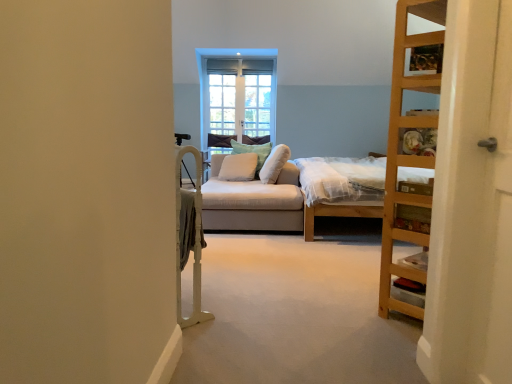
Question: In terms of width, does white soft cushion at center, arranged as the third pillow when viewed from the right, look wider or thinner when compared to clear glass window at center?

Choices:
 (A) thin
 (B) wide

Answer: (B)

Question: In the image, is white soft cushion at center, marked as the 1th pillow in a left-to-right arrangement, positioned in front of or behind clear glass window at center?

Choices:
 (A) behind
 (B) front

Answer: (B)

Question: Considering the real-world distances, which object is closest to the white soft cushion at center, arranged as the third pillow when viewed from the right?

Choices:
 (A) white wood screen door at right
 (B) light brown wooden bed at right
 (C) wooden ladder at right
 (D) clear glass window at center
 (E) white soft pillow at center, which is the first pillow from right to left

Answer: (E)

Question: Based on their relative distances, which object is farther from the white soft pillow at center, which is the first pillow from right to left?

Choices:
 (A) white wood screen door at right
 (B) light brown wooden bed at right
 (C) light beige fabric couch at center
 (D) white soft pillow at center, placed as the 2th pillow when sorted from left to right
 (E) wooden ladder at right

Answer: (A)